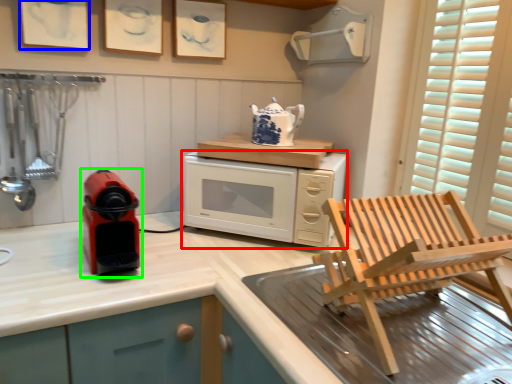
Question: Based on their relative distances, which object is farther from microwave oven (highlighted by a red box)? Choose from picture frame (highlighted by a blue box) and home appliance (highlighted by a green box).

Choices:
 (A) picture frame
 (B) home appliance

Answer: (A)